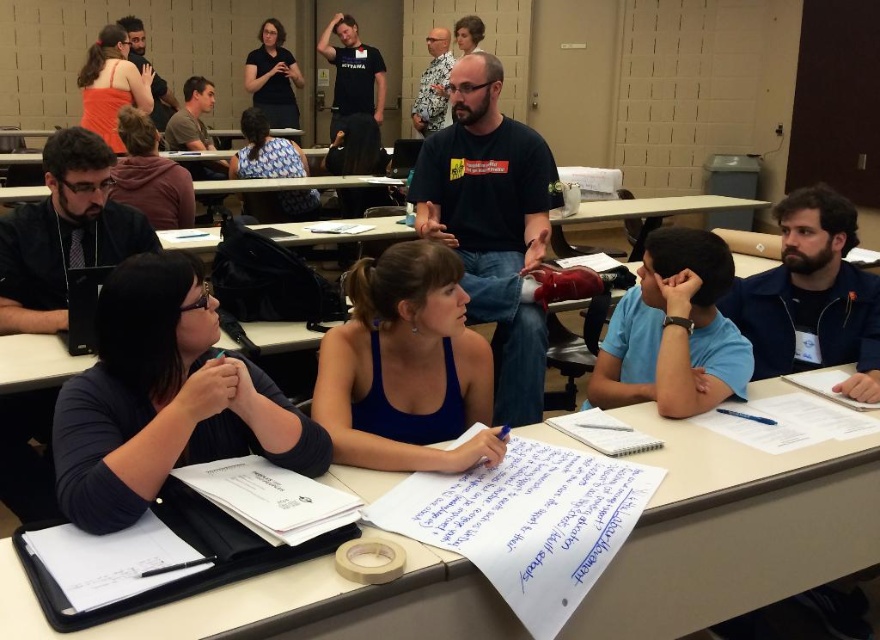
You are organizing a presentation and need to choose between the white paper at center and the white paper at lower left for your poster. Which one is bigger?

The white paper at center has a larger size compared to the white paper at lower left, so you should choose the white paper at center for your poster.

You are a participant in the classroom and want to reach the white paper at center to add a note. If you are standing 40 inches away from it, can you comfortably reach it without moving closer?

The white paper at center is 38.08 inches away from viewer, so yes, you can comfortably reach it without moving closer since you are only 40 inches away, which is just slightly farther than the paper distance.